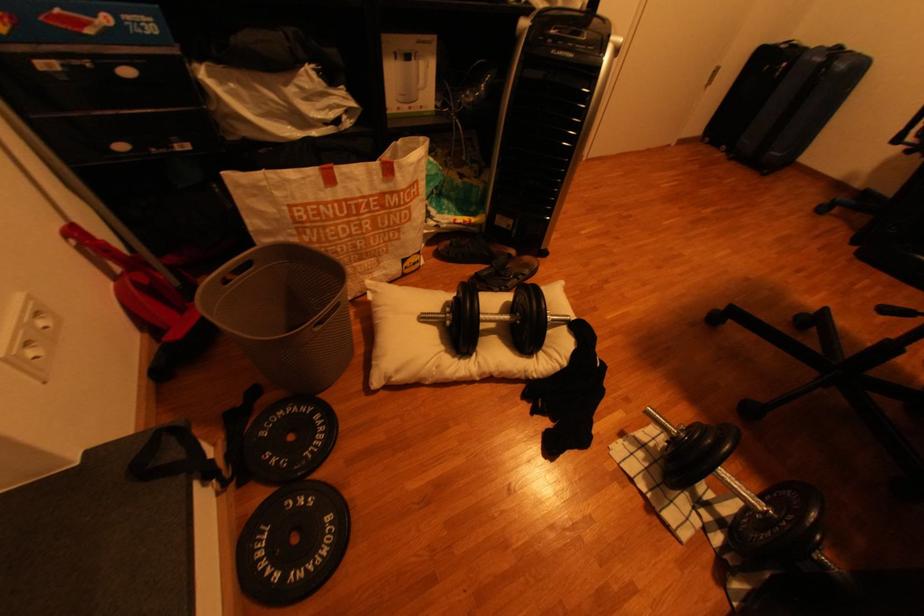
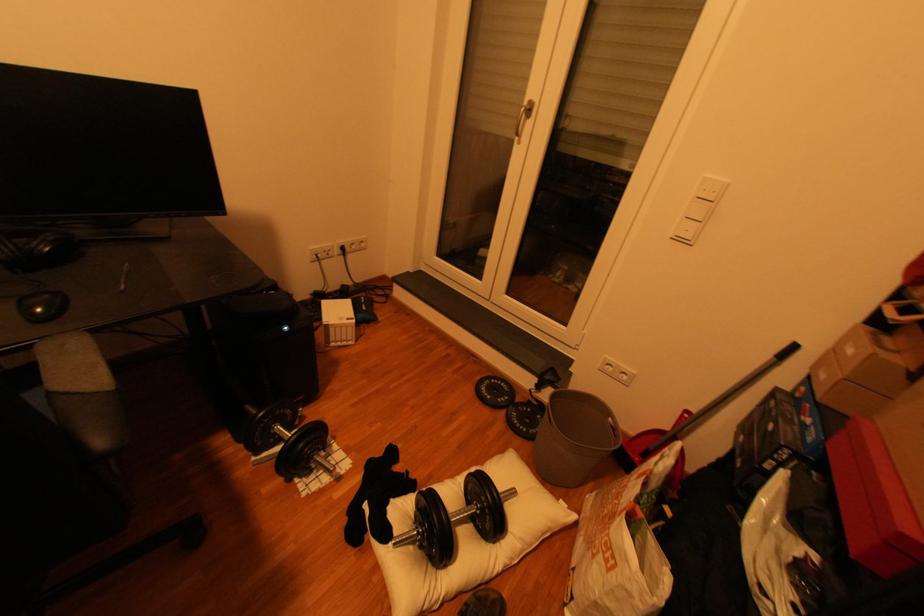
In the second image, find the point that corresponds to point 574,328 in the first image.

(406, 533)